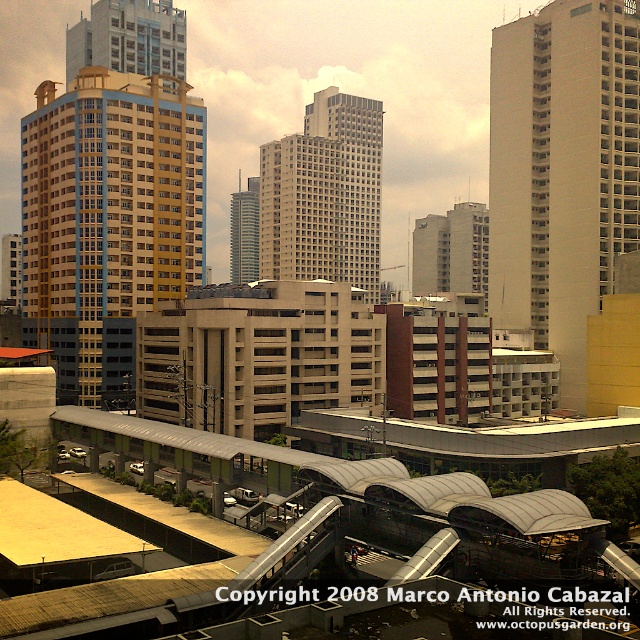
You are standing at the curved walkway in the urban landscape. You see a point marked at coordinates (563,170). What does this point correspond to in the scene?

The point at coordinates (563,170) corresponds to the white concrete building at center.

You are an architect analyzing the urban layout. Based on the scene, which of the two structures, the white concrete building at center or the matte glass skyscraper at upper left, has a narrower width?

The white concrete building at center is thinner than the matte glass skyscraper at upper left, so it has a narrower width.

Based on the photo, you are an urban planner assessing the space between the white concrete building at center and the matte glass skyscraper at upper left. Which building occupies more space in the scene?

The white concrete building at center is larger in size than the matte glass skyscraper at upper left, so it occupies more space in the scene.